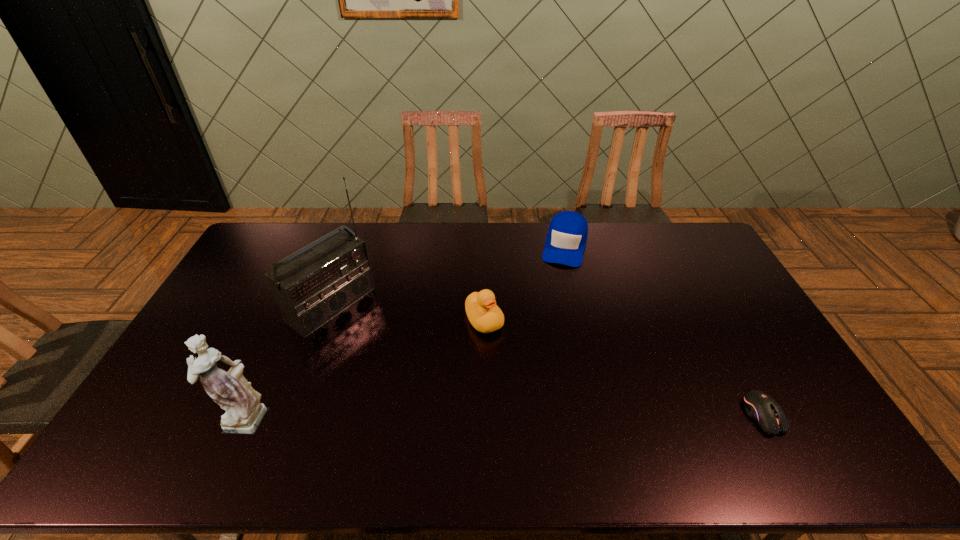
The width and height of the screenshot is (960, 540). I want to click on free space located on the front-facing side of the figurine, so click(143, 416).

This screenshot has height=540, width=960. What are the coordinates of `vacant space located on the back of the rightmost object` in the screenshot? It's located at (732, 357).

At what (x,y) coordinates should I click in order to perform the action: click on vacant point located 0.340m on the front panel of the radio receiver. Please return your answer as a coordinate pair (x, y). The image size is (960, 540). Looking at the image, I should click on (437, 379).

The width and height of the screenshot is (960, 540). In order to click on free point located on the front panel of the radio receiver in this screenshot , I will do `click(440, 381)`.

The height and width of the screenshot is (540, 960). Identify the location of free space located 0.060m on the front panel of the radio receiver. (370, 333).

The width and height of the screenshot is (960, 540). Identify the location of free location located 0.260m on the face of the third object from left to right. (543, 400).

Where is `blank space located 0.160m on the face of the third object from left to right`? This screenshot has width=960, height=540. blank space located 0.160m on the face of the third object from left to right is located at coordinates (522, 373).

You are a GUI agent. You are given a task and a screenshot of the screen. Output one action in this format:
    pyautogui.click(x=<x>, y=<y>)
    Task: Click on the free space located on the face of the third object from left to right
    This screenshot has width=960, height=540.
    Given the screenshot: What is the action you would take?
    pyautogui.click(x=518, y=368)

This screenshot has height=540, width=960. Find the location of `blank space located on the front-facing side of the second shortest object`. blank space located on the front-facing side of the second shortest object is located at coordinates (552, 308).

The height and width of the screenshot is (540, 960). What are the coordinates of `free space located on the front-facing side of the second shortest object` in the screenshot? It's located at (556, 292).